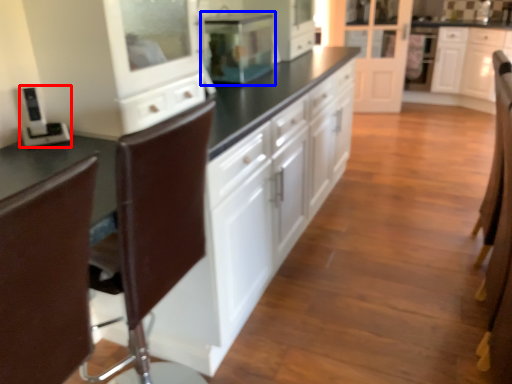
Question: Which object appears farthest to the camera in this image, appliance (highlighted by a red box) or home appliance (highlighted by a blue box)?

Choices:
 (A) appliance
 (B) home appliance

Answer: (B)